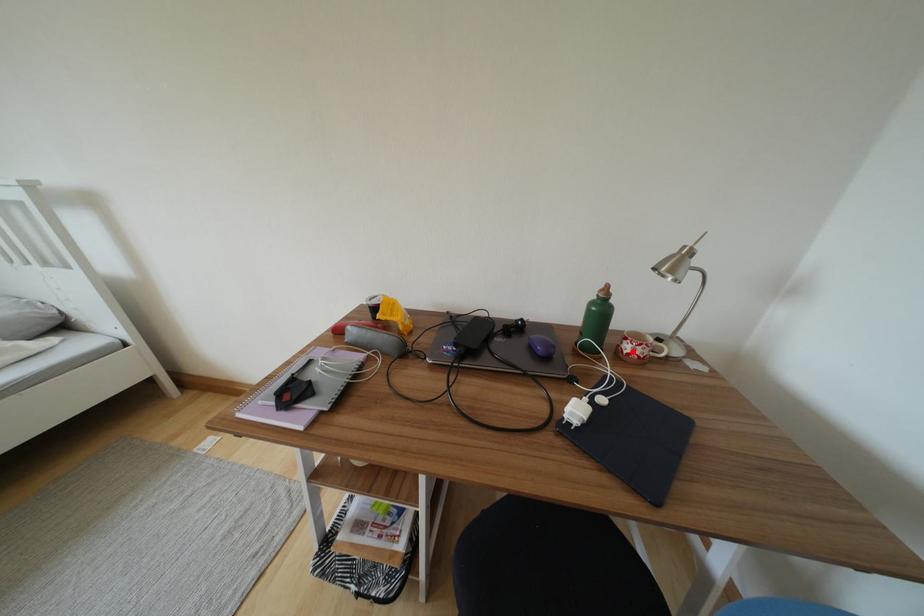
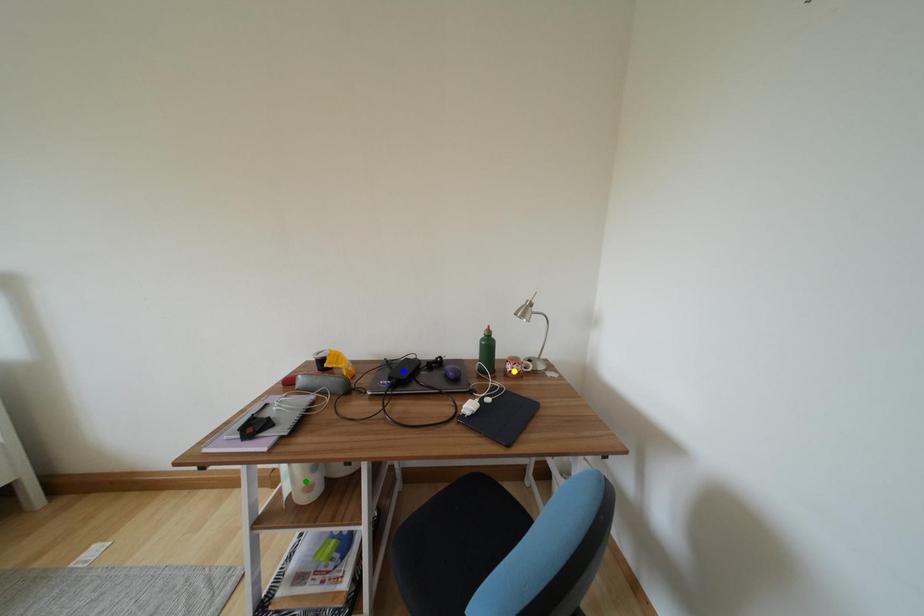
Question: I am providing you with two images of the same scene from different viewpoints. A red point is marked on the first image. You are given multiple points on the second image. In image 2, which mark is for the same physical point as the one in image 1?

Choices:
 (A) green point
 (B) blue point
 (C) yellow point

Answer: (C)